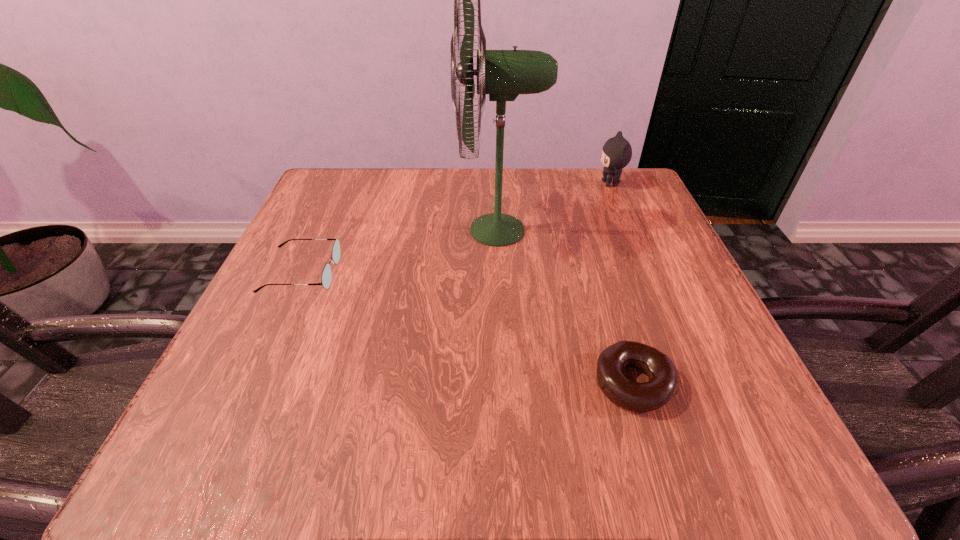
What are the coordinates of `empty space between the tallest object and the second tallest object` in the screenshot? It's located at coord(554,207).

Where is `vacant space in between the leftmost object and the rightmost object`? This screenshot has width=960, height=540. vacant space in between the leftmost object and the rightmost object is located at coordinates (456, 228).

Locate an element on the screen. vacant area that lies between the spectacles and the tallest object is located at coordinates (400, 252).

The width and height of the screenshot is (960, 540). I want to click on empty space between the second tallest object and the leftmost object, so click(456, 228).

Locate an element on the screen. The width and height of the screenshot is (960, 540). blank region between the tallest object and the spectacles is located at coordinates (400, 252).

Identify the location of free space that is in between the kitten and the nearest object. (621, 284).

Locate an element on the screen. Image resolution: width=960 pixels, height=540 pixels. vacant space in between the second object from right to left and the second tallest object is located at coordinates (621, 284).

You are a GUI agent. You are given a task and a screenshot of the screen. Output one action in this format:
    pyautogui.click(x=<x>, y=<y>)
    Task: Click on the free area in between the nearest object and the spectacles
    The height and width of the screenshot is (540, 960).
    Given the screenshot: What is the action you would take?
    pyautogui.click(x=468, y=328)

Select which object appears as the closest to the tallest object. Please provide its 2D coordinates. Your answer should be formatted as a tuple, i.e. [(x, y)], where the tuple contains the x and y coordinates of a point satisfying the conditions above.

[(616, 153)]

Point out which object is positioned as the second nearest to the spectacles. Please provide its 2D coordinates. Your answer should be formatted as a tuple, i.e. [(x, y)], where the tuple contains the x and y coordinates of a point satisfying the conditions above.

[(663, 384)]